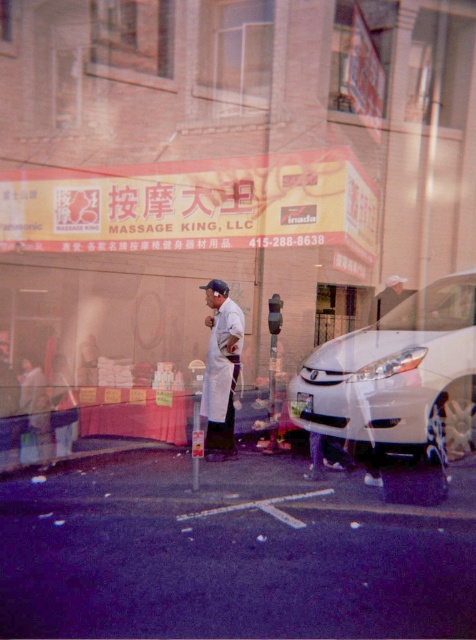
Locate an element on the screen. The height and width of the screenshot is (640, 476). yellow matte signboard at center is located at coordinates (168, 269).

In the scene shown: Can you confirm if white glossy car at right is bigger than matte white robe at lower left?

Yes, white glossy car at right is bigger than matte white robe at lower left.

Is white glossy car at right positioned behind matte white robe at lower left?

No, it is not.

Which is in front, point (436, 307) or point (38, 460)?

Point (436, 307)

Where is `white glossy car at right`? white glossy car at right is located at coordinates (398, 376).

Who is higher up, white glossy car at right or white lab coat at center?

Positioned higher is white glossy car at right.

Is point (325, 400) positioned after point (231, 416)?

No, it is in front of (231, 416).

At what (x,y) coordinates should I click in order to perform the action: click on white glossy car at right. Please return your answer as a coordinate pair (x, y). The height and width of the screenshot is (640, 476). Looking at the image, I should click on (398, 376).

Find the location of a particular element. white glossy car at right is located at coordinates (398, 376).